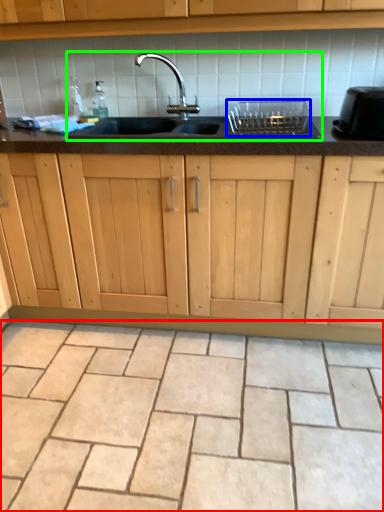
Question: Based on their relative distances, which object is nearer to ceramic tile (highlighted by a red box)? Choose from appliance (highlighted by a blue box) and sink (highlighted by a green box).

Choices:
 (A) appliance
 (B) sink

Answer: (B)